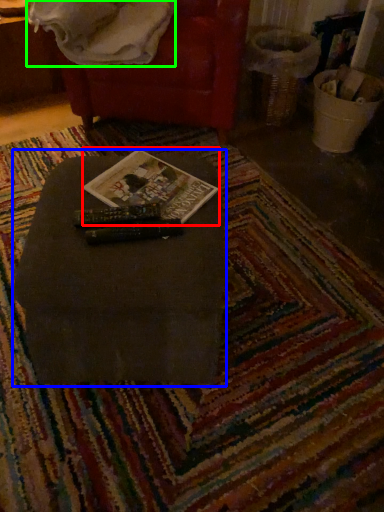
Question: Which object is positioned closest to paperback book (highlighted by a red box)? Select from table (highlighted by a blue box) and blanket (highlighted by a green box).

Choices:
 (A) table
 (B) blanket

Answer: (A)